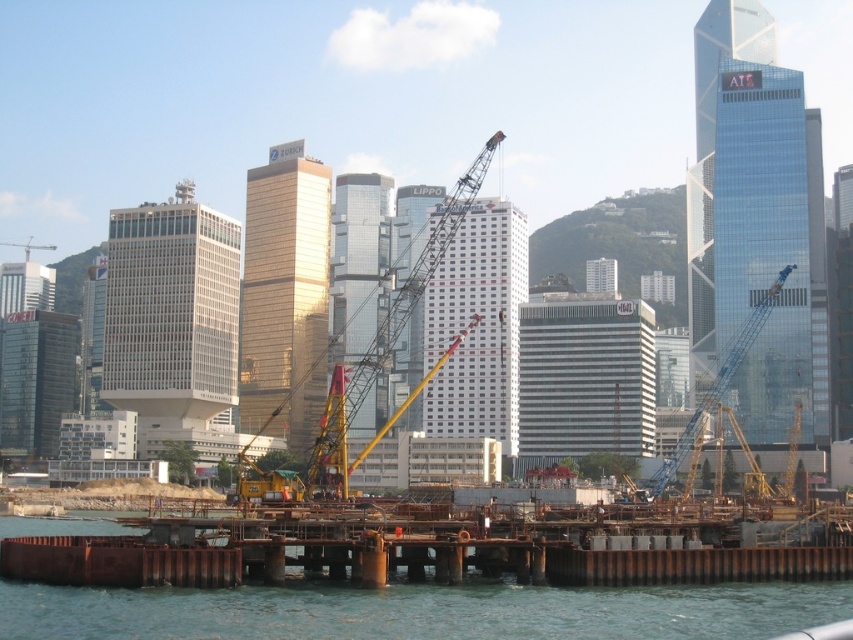
Does yellow metallic crane at center have a greater width compared to blue metallic crane at center?

Indeed, yellow metallic crane at center has a greater width compared to blue metallic crane at center.

Where is `yellow metallic crane at center`? This screenshot has width=853, height=640. yellow metallic crane at center is located at coordinates (368, 369).

You are a GUI agent. You are given a task and a screenshot of the screen. Output one action in this format:
    pyautogui.click(x=<x>, y=<y>)
    Task: Click on the yellow metallic crane at center
    The height and width of the screenshot is (640, 853).
    Given the screenshot: What is the action you would take?
    pyautogui.click(x=368, y=369)

The width and height of the screenshot is (853, 640). Describe the element at coordinates (421, 611) in the screenshot. I see `rusty metal water at lower center` at that location.

Is rusty metal water at lower center shorter than yellow metallic crane at center?

Yes.

Where is `rusty metal water at lower center`? The width and height of the screenshot is (853, 640). rusty metal water at lower center is located at coordinates (421, 611).

Image resolution: width=853 pixels, height=640 pixels. I want to click on rusty metal water at lower center, so click(x=421, y=611).

Which of these two, rusty metal water at lower center or blue metallic crane at center, stands shorter?

rusty metal water at lower center is shorter.

Does rusty metal water at lower center appear over blue metallic crane at center?

Incorrect, rusty metal water at lower center is not positioned above blue metallic crane at center.

Is point (769, 616) closer to viewer compared to point (735, 358)?

Yes, point (769, 616) is closer to viewer.

The height and width of the screenshot is (640, 853). In order to click on rusty metal water at lower center in this screenshot , I will do `click(421, 611)`.